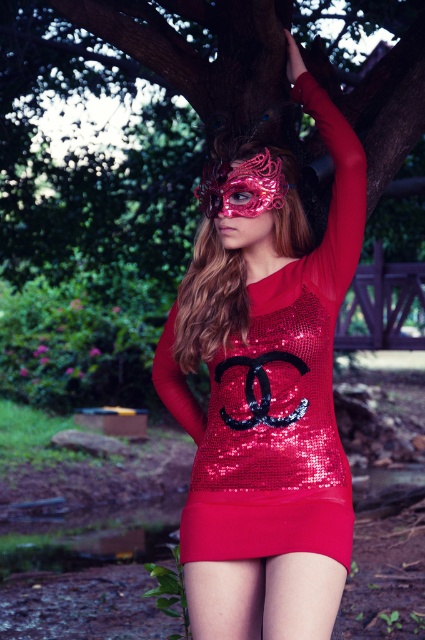
You are a fashion designer analyzing the outfit of the person in the image. Which item, the shiny sequined dress at center or the matte sequined skirt at lower center, is taller in height?

The shiny sequined dress at center has a greater height compared to the matte sequined skirt at lower center.

You are a photographer trying to capture the best angle of the person in the shiny sequined dress at center and the matte sequined skirt at lower center. Which object should you focus on first to ensure it appears larger in the photo?

The shiny sequined dress at center should be focused on first because it is closer to the viewer, making it appear larger in the photo compared to the matte sequined skirt at lower center which is farther away.

You are a fashion designer observing the person in the scene. You need to decide which item takes up more visual space in the outfit. Which one is larger between the shiny sequined dress at center and the matte sequined skirt at lower center?

The shiny sequined dress at center is larger in size than the matte sequined skirt at lower center, so it takes up more visual space in the outfit.